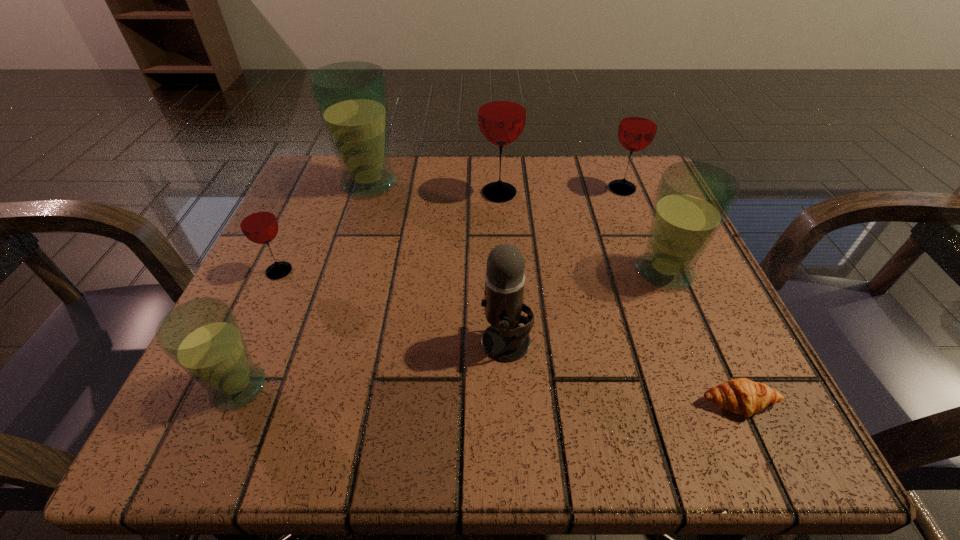
Locate an element on the screen. Image resolution: width=960 pixels, height=540 pixels. pastry located at the near edge is located at coordinates (742, 396).

Where is `pastry that is at the right edge`? The width and height of the screenshot is (960, 540). pastry that is at the right edge is located at coordinates (742, 396).

Image resolution: width=960 pixels, height=540 pixels. I want to click on object located in the far left corner section of the desktop, so click(351, 97).

Image resolution: width=960 pixels, height=540 pixels. I want to click on object positioned at the near left corner, so click(202, 336).

This screenshot has width=960, height=540. Identify the location of object positioned at the far right corner. (638, 125).

At what (x,y) coordinates should I click in order to perform the action: click on object present at the near right corner. Please return your answer as a coordinate pair (x, y). This screenshot has height=540, width=960. Looking at the image, I should click on click(742, 396).

Where is `blank space at the far edge of the desktop`? blank space at the far edge of the desktop is located at coordinates (477, 204).

Image resolution: width=960 pixels, height=540 pixels. What are the coordinates of `free space at the near edge of the desktop` in the screenshot? It's located at pyautogui.click(x=376, y=431).

Identify the location of vacant space at the left edge of the desktop. (306, 282).

In the image, there is a desktop. At what (x,y) coordinates should I click in order to perform the action: click on vacant area at the right edge. Please return your answer as a coordinate pair (x, y). The image size is (960, 540). Looking at the image, I should click on (673, 311).